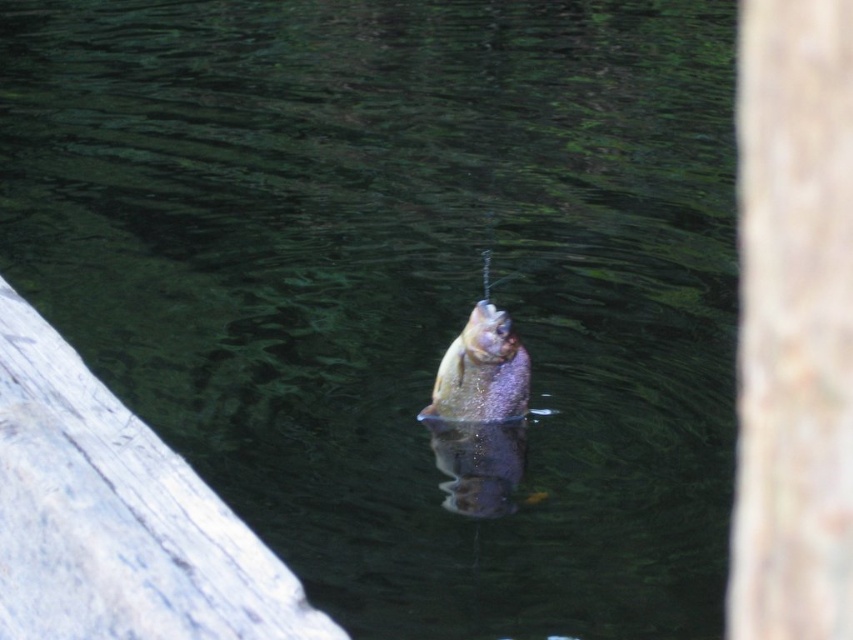
You are a fisherman holding a fishing rod with a fish caught on the line. You need to place the fish into a bucket located near the smooth brown tree trunk at right. Can you reach the bucket without moving your position? The bucket is 1 meter in height from the ground.

The smooth brown tree trunk at right is 74.86 centimeters away from the viewer. Since the bucket is located near it and the viewer is 74.86 cm away, the fisherman can likely reach the bucket if their arm length exceeds 74.86 cm. However, the bucket is 1 meter high, so the fisherman must also be able to lift the fish to that height. The answer depends on both reach and lifting capability.

You are an angler trying to land the shiny purple fish at center. The smooth brown tree trunk at right is blocking your path. Can you maneuver around the tree trunk to safely land the fish in the water?

The smooth brown tree trunk at right is above the shiny purple fish at center, so you can maneuver around the tree trunk by moving the fishing line to the left side to safely land the fish in the water.